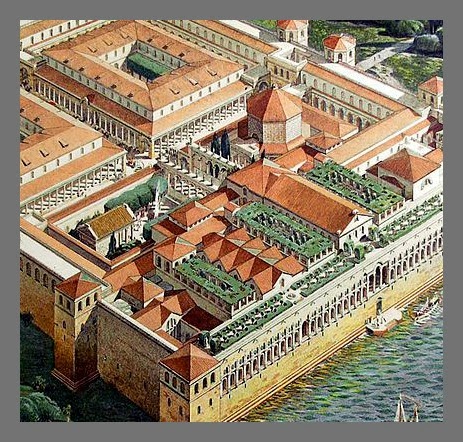
Identify the location of picture. (253, 252).